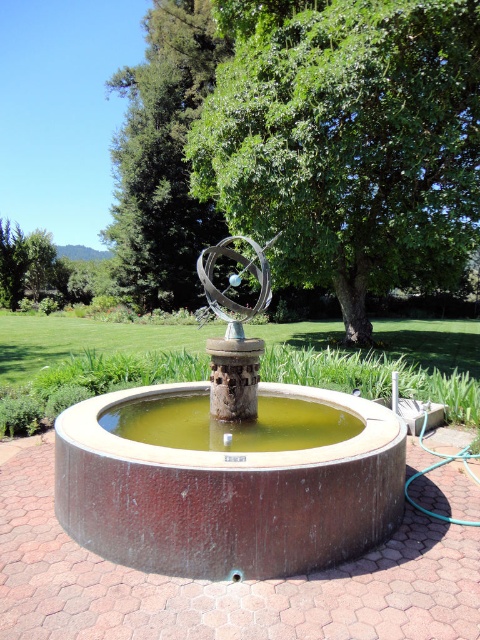
Does greenish-brown water at center appear on the right side of metallic sculpture at center?

Indeed, greenish-brown water at center is positioned on the right side of metallic sculpture at center.

Consider the image. Is greenish-brown water at center smaller than metallic sculpture at center?

Correct, greenish-brown water at center occupies less space than metallic sculpture at center.

Is point (288, 401) farther from viewer compared to point (242, 392)?

Yes, it is.

At what (x,y) coordinates should I click in order to perform the action: click on greenish-brown water at center. Please return your answer as a coordinate pair (x, y). Looking at the image, I should click on (228, 422).

Which of these two, rusty metal fountain at center or green leafy tree at upper left, stands taller?

green leafy tree at upper left is taller.

Locate an element on the screen. The image size is (480, 640). rusty metal fountain at center is located at coordinates (228, 464).

The image size is (480, 640). What do you see at coordinates (228, 464) in the screenshot?
I see `rusty metal fountain at center` at bounding box center [228, 464].

The width and height of the screenshot is (480, 640). I want to click on rusty metal fountain at center, so click(228, 464).

Consider the image. Does green leafy tree at center appear on the left side of metallic sculpture at center?

No, green leafy tree at center is not to the left of metallic sculpture at center.

Who is more forward, (372, 230) or (208, 262)?

Point (208, 262) is in front.

I want to click on green leafy tree at center, so click(x=348, y=140).

Where is `green leafy tree at center`? The height and width of the screenshot is (640, 480). green leafy tree at center is located at coordinates (348, 140).